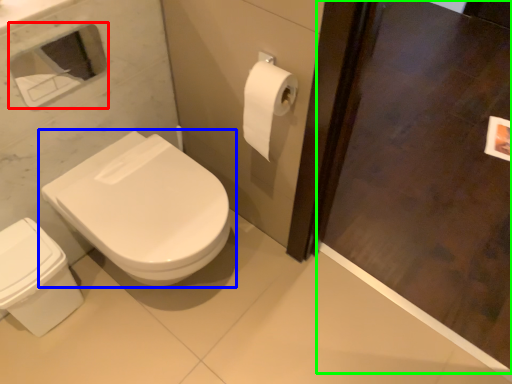
Question: Considering the real-world distances, which object is closest to medicine cabinet (highlighted by a red box)? toilet (highlighted by a blue box) or screen door (highlighted by a green box).

Choices:
 (A) toilet
 (B) screen door

Answer: (A)